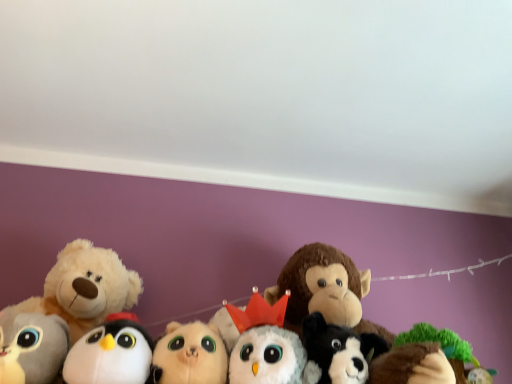
Question: Based on their sizes in the image, would you say green plush tree at lower right, arranged as the seventh toy when viewed from the left, is bigger or smaller than white plush owl at center, which is the third toy in right-to-left order?

Choices:
 (A) big
 (B) small

Answer: (B)

Question: Would you say green plush tree at lower right, acting as the 1th toy starting from the right, is inside or outside white plush owl at center, which is the third toy in right-to-left order?

Choices:
 (A) outside
 (B) inside

Answer: (A)

Question: Which of these objects is positioned farthest from the white plush dog at center, the 6th toy from the left?

Choices:
 (A) green plush tree at lower right, acting as the 1th toy starting from the right
 (B) fluffy beige cat at center, acting as the 4th toy starting from the right
 (C) white plush penguin at lower left, the 5th toy positioned from the right
 (D) fluffy white teddy bear at left, arranged as the sixth toy when viewed from the right
 (E) gray plush toy at lower left, the first toy when ordered from left to right

Answer: (E)

Question: Estimate the real-world distances between objects in this image. Which object is farther from the white plush dog at center, which is the second toy from right to left?

Choices:
 (A) white plush penguin at lower left, placed as the 3th toy when sorted from left to right
 (B) green plush tree at lower right, arranged as the seventh toy when viewed from the left
 (C) fluffy white teddy bear at left, arranged as the sixth toy when viewed from the right
 (D) fluffy beige cat at center, which is counted as the 4th toy, starting from the left
 (E) white plush owl at center, the 5th toy when ordered from left to right

Answer: (C)